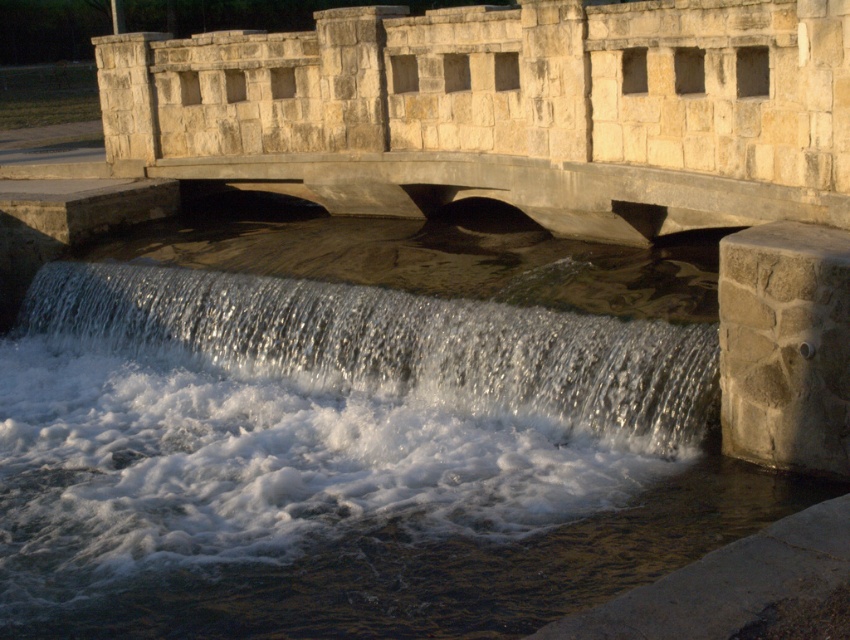
Question: Does stone bridge at center appear over gray stone/rough at lower right?

Choices:
 (A) yes
 (B) no

Answer: (A)

Question: Estimate the real-world distances between objects in this image. Which object is farther from the gray stone/rough at lower right?

Choices:
 (A) stone bridge at center
 (B) clear water at center

Answer: (A)

Question: Which object appears closest to the camera in this image?

Choices:
 (A) stone bridge at center
 (B) gray stone/rough at lower right

Answer: (B)

Question: Which object is closer to the camera taking this photo?

Choices:
 (A) stone bridge at center
 (B) clear water at center
 (C) gray stone/rough at lower right

Answer: (C)

Question: Is clear water at center to the right of gray stone/rough at lower right from the viewer's perspective?

Choices:
 (A) yes
 (B) no

Answer: (B)

Question: Considering the relative positions of stone bridge at center and clear water at center in the image provided, where is stone bridge at center located with respect to clear water at center?

Choices:
 (A) above
 (B) below

Answer: (A)